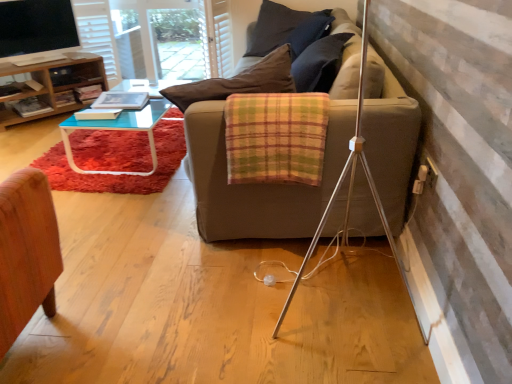
Where is `dark fabric pillow at upper center`? The image size is (512, 384). dark fabric pillow at upper center is located at coordinates (275, 27).

This screenshot has height=384, width=512. Identify the location of white textured curtain at upper center. (218, 37).

At what (x,y) coordinates should I click in order to perform the action: click on transparent glass screen door at upper left. Please return your answer as a coordinate pair (x, y). The width and height of the screenshot is (512, 384). Looking at the image, I should click on (174, 38).

Find the location of a particular element. The height and width of the screenshot is (384, 512). dark fabric pillow at upper center is located at coordinates click(275, 27).

Is dark fabric pillow at upper center positioned far away from transparent glass screen door at upper left?

That's not correct — dark fabric pillow at upper center is a little close to transparent glass screen door at upper left.

Is dark fabric pillow at upper center taller than transparent glass screen door at upper left?

No.

Is dark fabric pillow at upper center further to the viewer compared to transparent glass screen door at upper left?

No, it is not.

Does dark fabric pillow at upper center have a lesser width compared to transparent glass screen door at upper left?

Incorrect, the width of dark fabric pillow at upper center is not less than that of transparent glass screen door at upper left.

Which is behind, point (35, 39) or point (216, 39)?

The point (216, 39) is behind.

From the image's perspective, which is above, matte black screen at upper left or transparent glass screen door at upper left?

transparent glass screen door at upper left appears higher in the image.

Considering the sizes of objects matte black screen at upper left and transparent glass screen door at upper left in the image provided, who is shorter, matte black screen at upper left or transparent glass screen door at upper left?

With less height is matte black screen at upper left.

From the image's perspective, is transparent glass screen door at upper left located above or below white textured curtain at upper center?

From the image's perspective, transparent glass screen door at upper left appears above white textured curtain at upper center.

Would you say transparent glass screen door at upper left is outside white textured curtain at upper center?

Indeed, transparent glass screen door at upper left is completely outside white textured curtain at upper center.

You are a GUI agent. You are given a task and a screenshot of the screen. Output one action in this format:
    pyautogui.click(x=<x>, y=<y>)
    Task: Click on the curtain that appears in front of the transparent glass screen door at upper left
    The image size is (512, 384).
    Given the screenshot: What is the action you would take?
    pyautogui.click(x=218, y=37)

Between woodenmaterial/texturetable at left and transparent glass screen door at upper left, which one has smaller width?

transparent glass screen door at upper left.

Does point (103, 77) appear closer or farther from the camera than point (164, 38)?

Point (103, 77) is positioned closer to the camera compared to point (164, 38).

Based on the photo, based on their sizes in the image, would you say woodenmaterial/texturetable at left is bigger or smaller than transparent glass screen door at upper left?

woodenmaterial/texturetable at left is smaller than transparent glass screen door at upper left.

How far apart are woodenmaterial/texturetable at left and transparent glass screen door at upper left?

A distance of 30.87 inches exists between woodenmaterial/texturetable at left and transparent glass screen door at upper left.

In the scene shown: Is plaid fabric blanket at center completely or partially outside of white textured curtain at upper center?

Yes, plaid fabric blanket at center is not within white textured curtain at upper center.

Is plaid fabric blanket at center bigger than white textured curtain at upper center?

Actually, plaid fabric blanket at center might be smaller than white textured curtain at upper center.

Measure the distance between plaid fabric blanket at center and white textured curtain at upper center.

2.33 meters.

Is plaid fabric blanket at center touching white textured curtain at upper center?

No, plaid fabric blanket at center is not next to white textured curtain at upper center.

Can we say dark fabric pillow at upper center lies outside white textured curtain at upper center?

dark fabric pillow at upper center lies outside white textured curtain at upper center's area.

Which object is positioned more to the right, dark fabric pillow at upper center or white textured curtain at upper center?

dark fabric pillow at upper center is more to the right.

Can you confirm if dark fabric pillow at upper center is thinner than white textured curtain at upper center?

Incorrect, the width of dark fabric pillow at upper center is not less than that of white textured curtain at upper center.

Can you confirm if dark fabric pillow at upper center is taller than white textured curtain at upper center?

Incorrect, the height of dark fabric pillow at upper center is not larger of that of white textured curtain at upper center.

From the picture: From the image's perspective, is dark fabric pillow at upper center under woodenmaterial/texturetable at left?

Incorrect, from the image's perspective, dark fabric pillow at upper center is higher than woodenmaterial/texturetable at left.

Based on the photo, is dark fabric pillow at upper center inside the boundaries of woodenmaterial/texturetable at left, or outside?

dark fabric pillow at upper center lies outside woodenmaterial/texturetable at left.

Does dark fabric pillow at upper center appear on the left side of woodenmaterial/texturetable at left?

No, dark fabric pillow at upper center is not to the left of woodenmaterial/texturetable at left.

Based on the photo, is dark fabric pillow at upper center aimed at woodenmaterial/texturetable at left?

No, dark fabric pillow at upper center is not turned towards woodenmaterial/texturetable at left.

Locate an element on the screen. The image size is (512, 384). pillow above the transparent glass screen door at upper left (from a real-world perspective) is located at coordinates tap(275, 27).

Find the location of a particular element. This screenshot has width=512, height=384. television that is on the left side of transparent glass screen door at upper left is located at coordinates (36, 28).

In the scene shown: Which object lies further to the anchor point dark fabric pillow at upper center, white textured curtain at upper center or plaid fabric blanket at center?

plaid fabric blanket at center lies further to dark fabric pillow at upper center than the other object.

Based on their spatial positions, is dark fabric pillow at upper center or woodenmaterial/texturetable at left further from matte black screen at upper left?

dark fabric pillow at upper center is further to matte black screen at upper left.

Based on their spatial positions, is dark fabric pillow at upper center or matte black screen at upper left closer to woodenmaterial/texturetable at left?

matte black screen at upper left.

Estimate the real-world distances between objects in this image. Which object is further from woodenmaterial/texturetable at left, matte black screen at upper left or dark fabric pillow at upper center?

The object further to woodenmaterial/texturetable at left is dark fabric pillow at upper center.

When comparing their distances from woodenmaterial/texturetable at left, does plaid fabric blanket at center or transparent glass screen door at upper left seem further?

Based on the image, plaid fabric blanket at center appears to be further to woodenmaterial/texturetable at left.

Estimate the real-world distances between objects in this image. Which object is closer to matte black screen at upper left, woodenmaterial/texturetable at left or white textured curtain at upper center?

woodenmaterial/texturetable at left is positioned closer to the anchor matte black screen at upper left.

When comparing their distances from white textured curtain at upper center, does transparent glass screen door at upper left or woodenmaterial/texturetable at left seem closer?

transparent glass screen door at upper left.

Estimate the real-world distances between objects in this image. Which object is further from plaid fabric blanket at center, transparent glass screen door at upper left or white textured curtain at upper center?

Among the two, transparent glass screen door at upper left is located further to plaid fabric blanket at center.

At what (x,y) coordinates should I click in order to perform the action: click on television located between woodenmaterial/texturetable at left and transparent glass screen door at upper left in the left-right direction. Please return your answer as a coordinate pair (x, y). The width and height of the screenshot is (512, 384). Looking at the image, I should click on (36, 28).

Locate an element on the screen. curtain between plaid fabric blanket at center and transparent glass screen door at upper left in the front-back direction is located at coordinates 218,37.

This screenshot has height=384, width=512. In order to click on screen door between matte black screen at upper left and dark fabric pillow at upper center in this screenshot , I will do `click(174, 38)`.

Find the location of a particular element. This screenshot has width=512, height=384. television between plaid fabric blanket at center and white textured curtain at upper center along the z-axis is located at coordinates (36, 28).